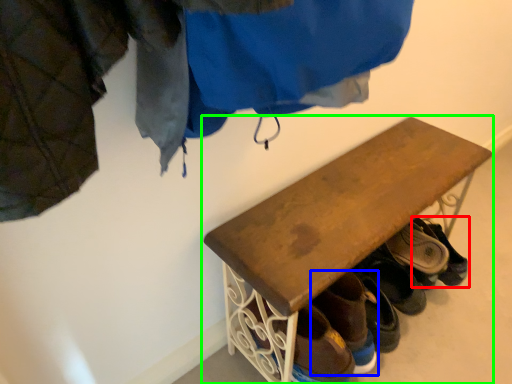
Question: Which object is the farthest from footwear (highlighted by a red box)? Choose among these: footwear (highlighted by a blue box) or furniture (highlighted by a green box).

Choices:
 (A) footwear
 (B) furniture

Answer: (B)